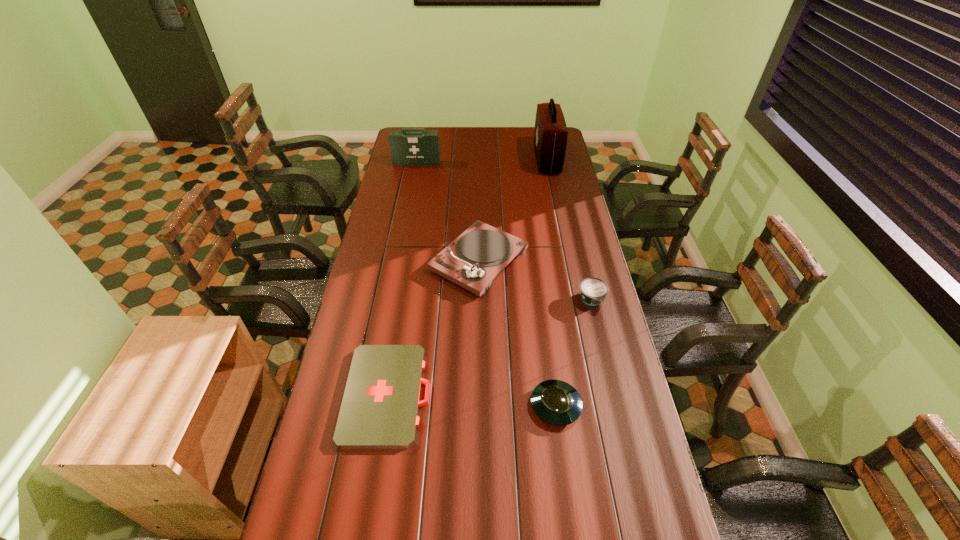
Identify the location of the tallest first-aid kit. (550, 136).

Where is `the rightmost first-aid kit`? This screenshot has height=540, width=960. the rightmost first-aid kit is located at coordinates (550, 136).

Where is `the second tallest first-aid kit`? The image size is (960, 540). the second tallest first-aid kit is located at coordinates (410, 146).

Image resolution: width=960 pixels, height=540 pixels. I want to click on the fourth shortest object, so click(472, 261).

Identify the location of yogurt. The width and height of the screenshot is (960, 540). (593, 291).

Identify the location of saucer. The width and height of the screenshot is (960, 540). tap(555, 402).

The height and width of the screenshot is (540, 960). Find the location of `the shortest first-aid kit`. the shortest first-aid kit is located at coordinates (380, 404).

Locate an element on the screen. Image resolution: width=960 pixels, height=540 pixels. the nearest first-aid kit is located at coordinates (380, 404).

Locate an element on the screen. free space located on the side of the tallest object with the cross symbol is located at coordinates (492, 160).

Locate an element on the screen. The height and width of the screenshot is (540, 960). free space located 0.190m on the side of the tallest object with the cross symbol is located at coordinates (498, 160).